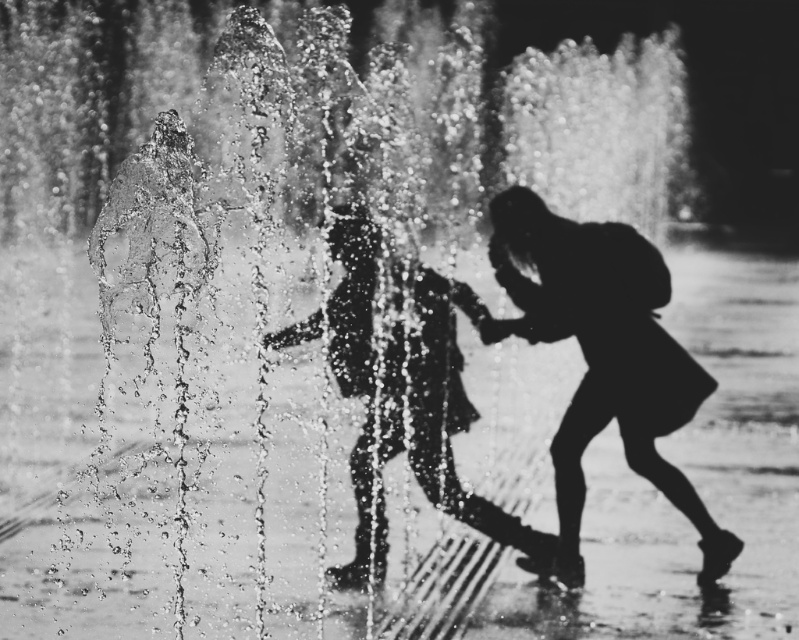
Question: Does silhouette dress at lower right appear on the right side of silhouette dress at center?

Choices:
 (A) yes
 (B) no

Answer: (A)

Question: Which point is farther from the camera taking this photo?

Choices:
 (A) (328, 326)
 (B) (633, 413)

Answer: (A)

Question: Which point is closer to the camera?

Choices:
 (A) silhouette dress at center
 (B) silhouette dress at lower right

Answer: (A)

Question: Is silhouette dress at lower right to the right of silhouette dress at center from the viewer's perspective?

Choices:
 (A) yes
 (B) no

Answer: (A)

Question: Does silhouette dress at lower right have a lesser width compared to silhouette dress at center?

Choices:
 (A) yes
 (B) no

Answer: (B)